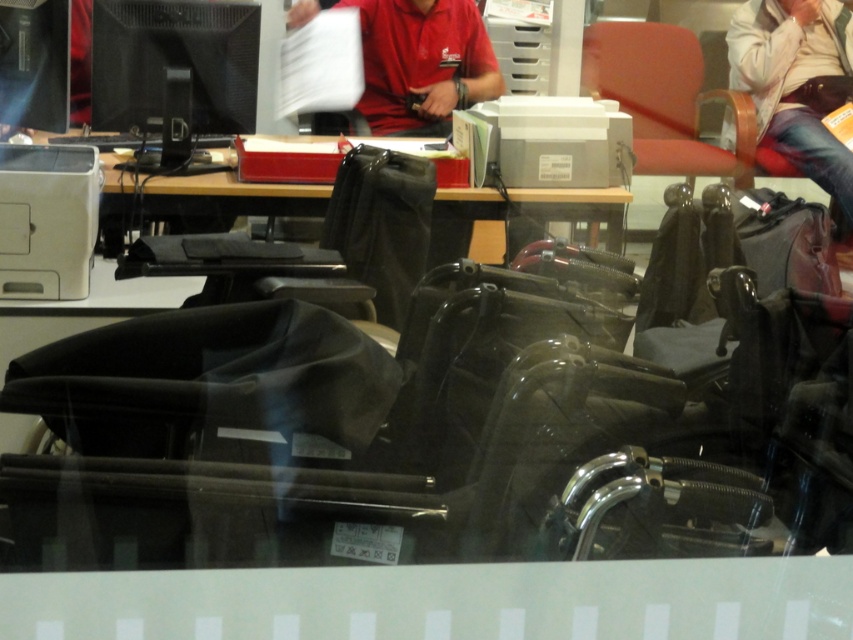
You are a delivery person who needs to place a package between the black matte monitor at upper left and the camera. The package requires a minimum of 3 meters of space to fit. Is there enough space between them?

The black matte monitor at upper left and camera are 2.85 meters apart from each other, which is less than the required 3 meters. Therefore, there isn not enough space to place the package between them.

You are organizing an office space and need to place a new keyboard that requires 30 cm of space. The black matte monitor at upper left and the matte red chair at upper right are in the way. Which object should you move to free up enough space for the keyboard?

The black matte monitor at upper left has a smaller size compared to the matte red chair at upper right, so moving the smaller black matte monitor at upper left would free up enough space for the keyboard.